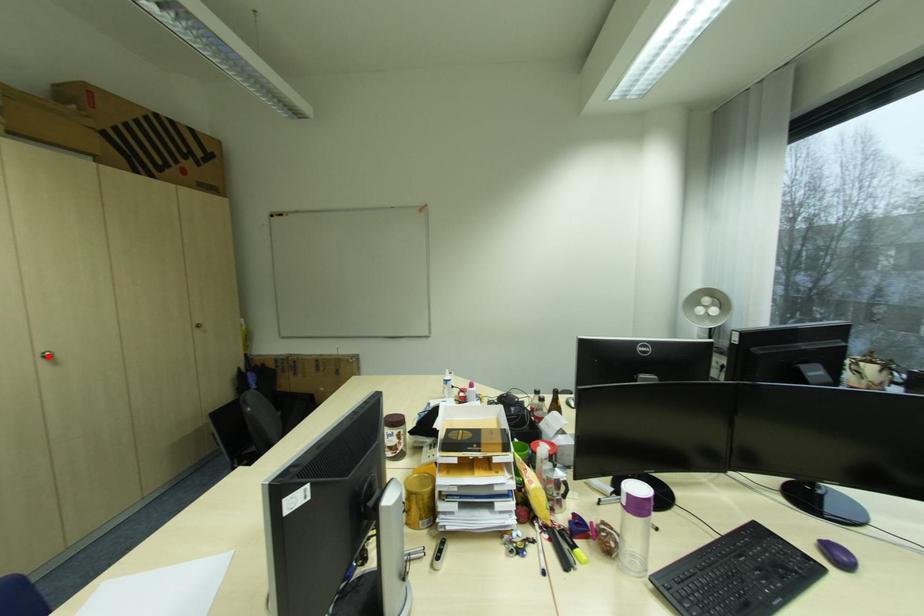
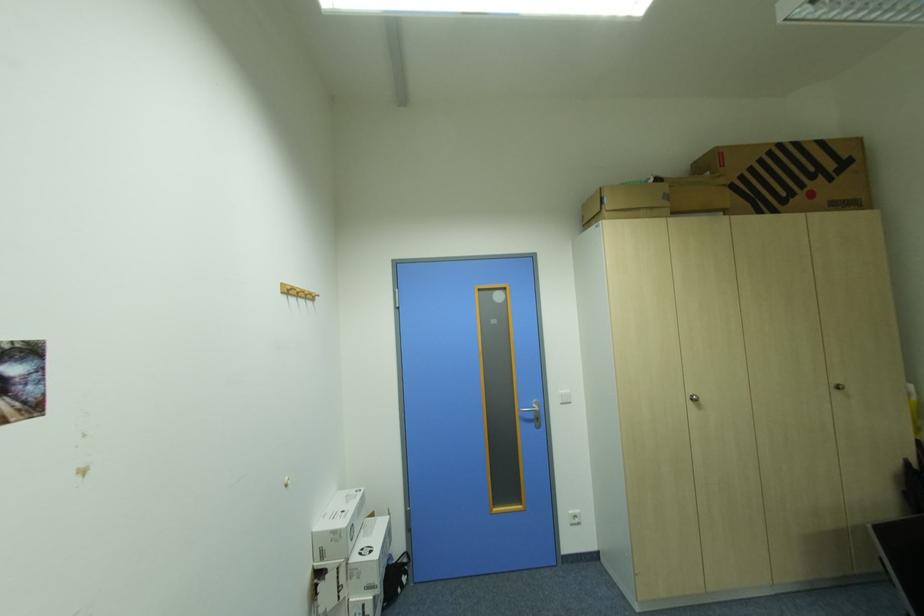
Locate, in the second image, the point that corresponds to the highlighted location in the first image.

(697, 399)